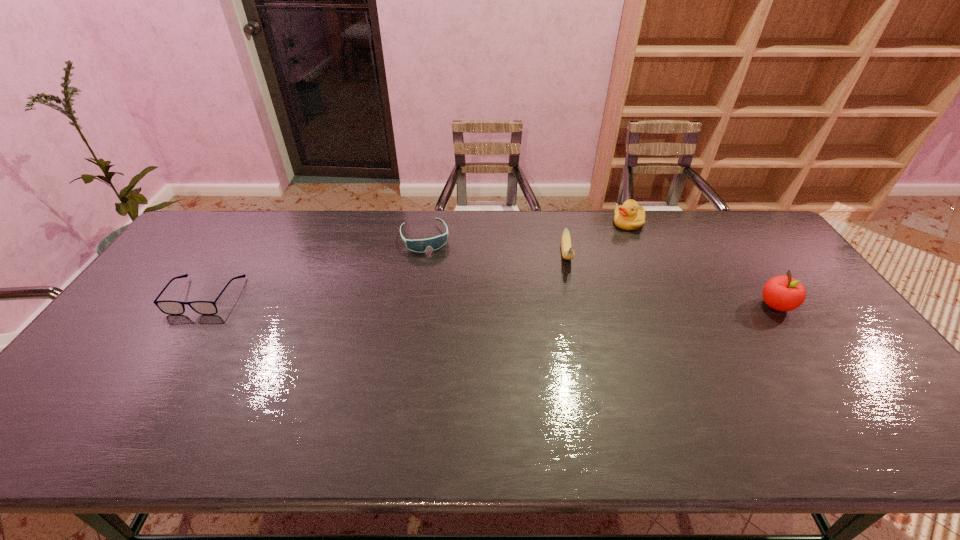
The height and width of the screenshot is (540, 960). Identify the location of free space between the third object from left to right and the leftmost object. (386, 275).

Image resolution: width=960 pixels, height=540 pixels. What are the coordinates of `empty space between the fourth object from right to left and the rightmost object` in the screenshot? It's located at (600, 272).

Where is `free spot between the banana and the tallest object`? free spot between the banana and the tallest object is located at coordinates point(671,280).

At what (x,y) coordinates should I click in order to perform the action: click on vacant space that is in between the leftmost object and the rightmost object. Please return your answer as a coordinate pair (x, y). This screenshot has width=960, height=540. Looking at the image, I should click on (491, 300).

Find the location of a particular element. The height and width of the screenshot is (540, 960). vacant space that's between the second object from left to right and the fourth object from left to right is located at coordinates (527, 230).

Where is `vacant space that's between the banana and the second object from left to right`? This screenshot has height=540, width=960. vacant space that's between the banana and the second object from left to right is located at coordinates (495, 246).

This screenshot has width=960, height=540. In order to click on free space that is in between the third object from right to left and the fourth object from left to right in this screenshot , I will do `click(597, 239)`.

Identify the location of free area in between the leftmost object and the duckling. This screenshot has height=540, width=960. (417, 259).

Image resolution: width=960 pixels, height=540 pixels. Find the location of `object identified as the second closest to the tallest object`. object identified as the second closest to the tallest object is located at coordinates [x=568, y=253].

Image resolution: width=960 pixels, height=540 pixels. I want to click on object that ranks as the closest to the banana, so click(x=629, y=216).